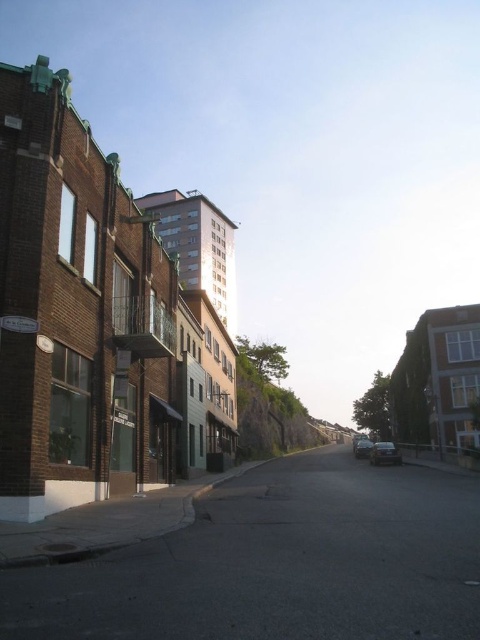
You are a pedestrian standing on the sidewalk next to the dark asphalt road at center. You see a shiny silver sedan at center approaching you. If the sedan is moving at 10 km per hour, how many seconds will it take for the sedan to reach the point where you are standing?

The distance between the dark asphalt road at center and the shiny silver sedan at center is 27.16 meters. Since the sedan is moving at 10 km per hour, converting that speed to meters per second gives approximately 2.778 mps. Dividing the distance by the speed yields 27.16 meters divided by 2.778 mps equals roughly 9.77 seconds. Therefore, the sedan will reach the pedestrian in about 10 seconds.

You are a pedestrian standing on the sidewalk and want to cross the dark asphalt road at center. There is a shiny silver sedan at center in your path. Based on the scene description, can you safely step onto the road to cross?

The dark asphalt road at center is above the shiny silver sedan at center, which means the sedan is parked or stopped on the road. Since the sedan is stationary, you can safely step onto the road at center to cross, provided you check for any oncoming traffic or other hazards.